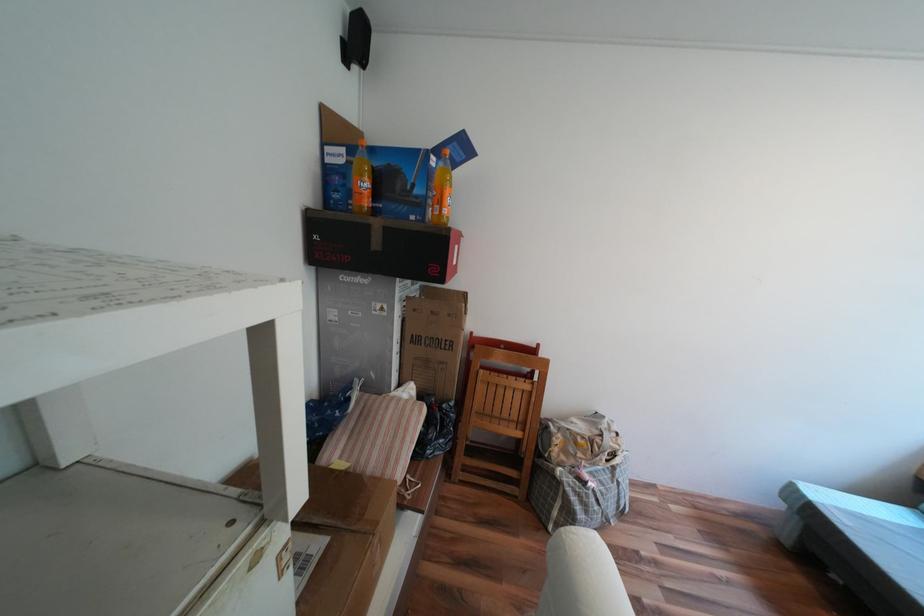
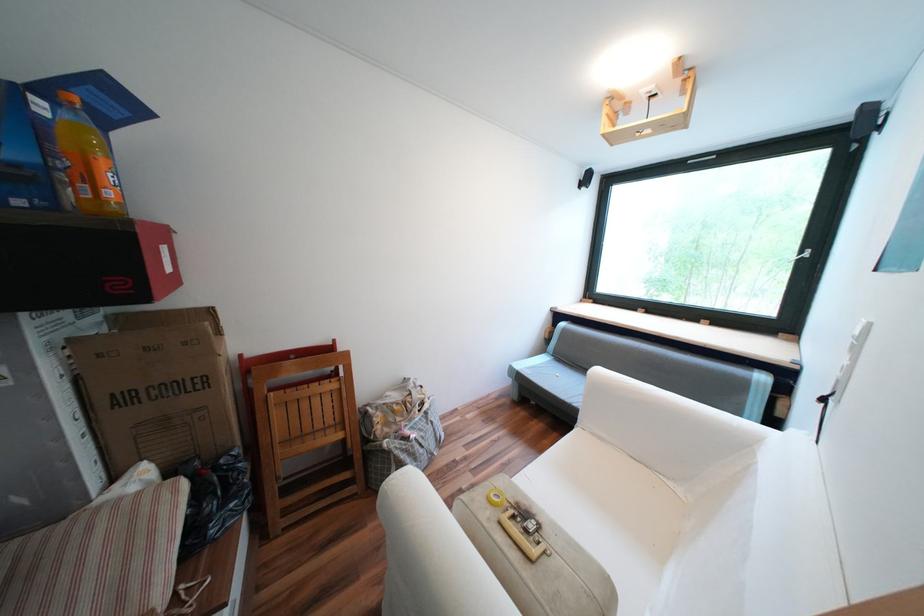
Where in the second image is the point corresponding to (564,439) from the first image?

(383, 419)